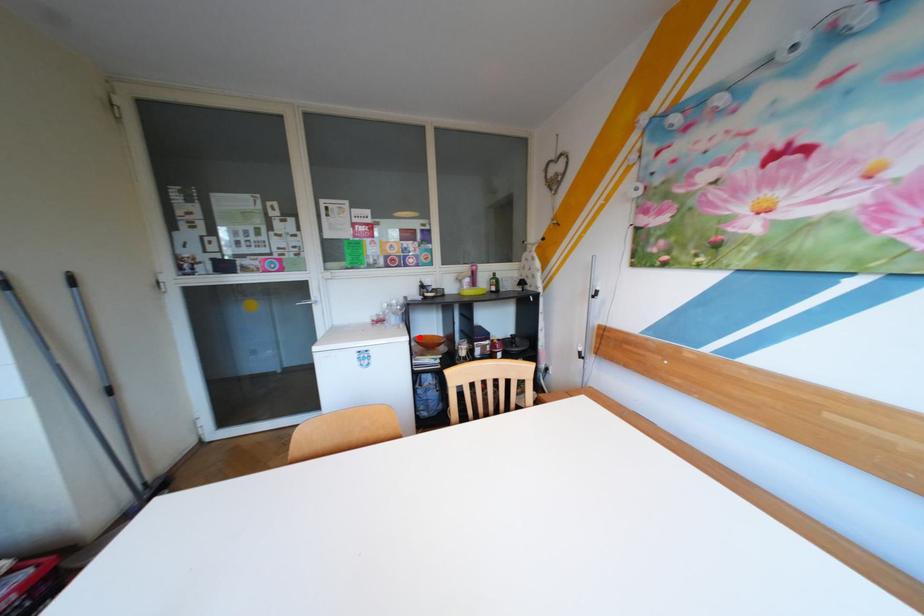
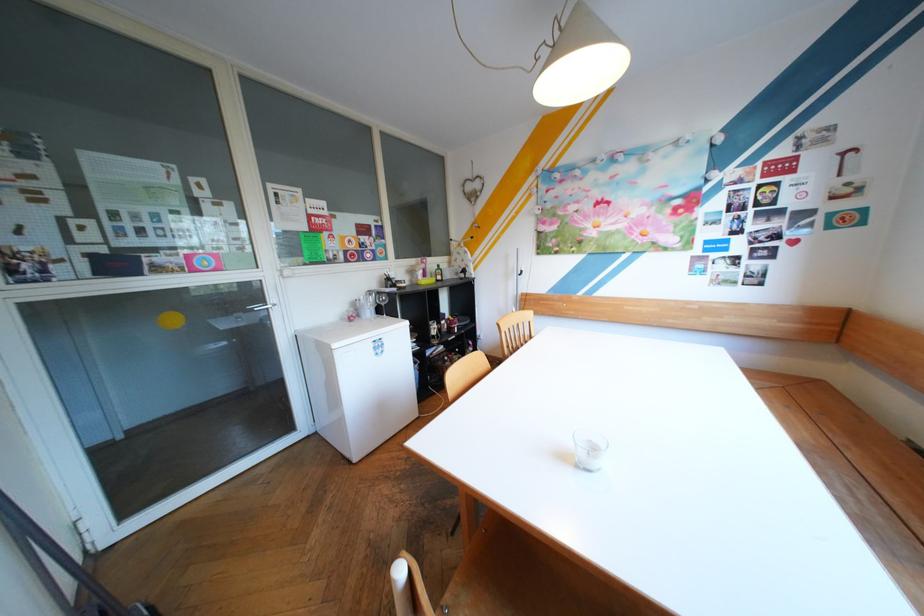
Question: I am providing you with two images of the same scene from different viewpoints. A red point is marked on the first image. Can you still see the location of the red point in image 2?

Choices:
 (A) Yes
 (B) No

Answer: (B)